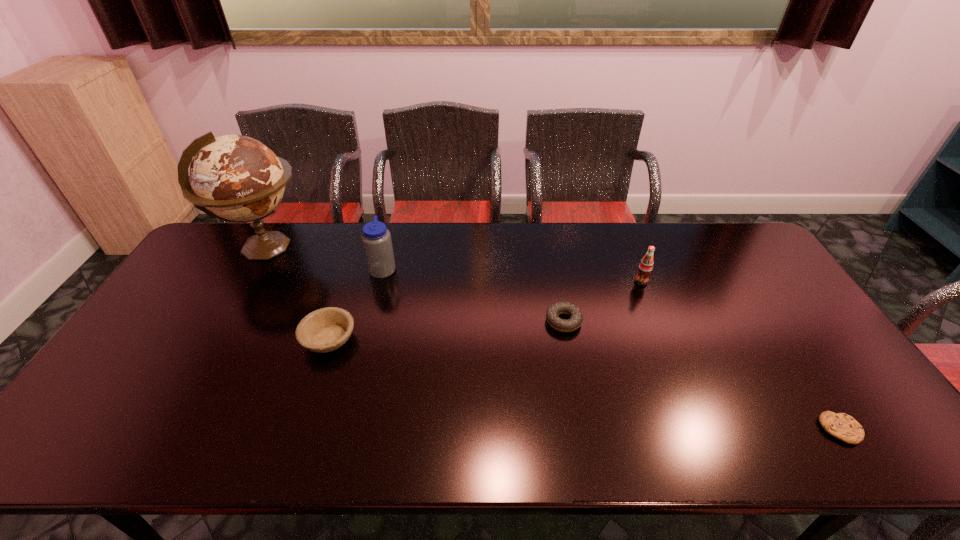
Identify the location of object located at the right edge. The width and height of the screenshot is (960, 540). (842, 426).

Identify the location of object that is at the far left corner. The width and height of the screenshot is (960, 540). (235, 178).

Locate an element on the screen. The image size is (960, 540). object situated at the near right corner is located at coordinates (842, 426).

Image resolution: width=960 pixels, height=540 pixels. I want to click on free spot at the far edge of the desktop, so click(x=457, y=262).

The image size is (960, 540). Find the location of `free region at the near edge`. free region at the near edge is located at coordinates (348, 443).

Identify the location of vacant space at the left edge of the desktop. Image resolution: width=960 pixels, height=540 pixels. (187, 284).

Identify the location of vacant space at the right edge of the desktop. (753, 270).

Where is `vacant space at the far right corner of the desktop`? Image resolution: width=960 pixels, height=540 pixels. vacant space at the far right corner of the desktop is located at coordinates (737, 248).

Locate an element on the screen. This screenshot has width=960, height=540. unoccupied position between the third object from right to left and the soda is located at coordinates (602, 301).

This screenshot has height=540, width=960. Identify the location of blank region between the second object from right to left and the leftmost object. (454, 265).